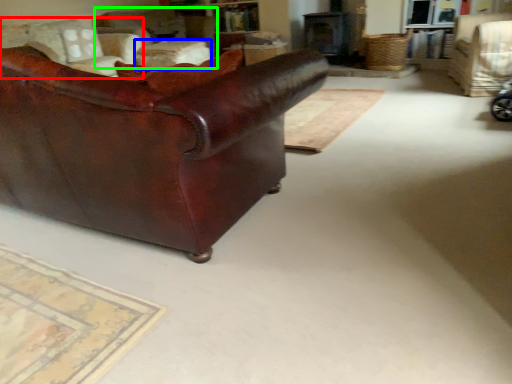
Question: Estimate the real-world distances between objects in this image. Which object is farther from chair (highlighted by a red box), table (highlighted by a blue box) or chair (highlighted by a green box)?

Choices:
 (A) table
 (B) chair

Answer: (A)